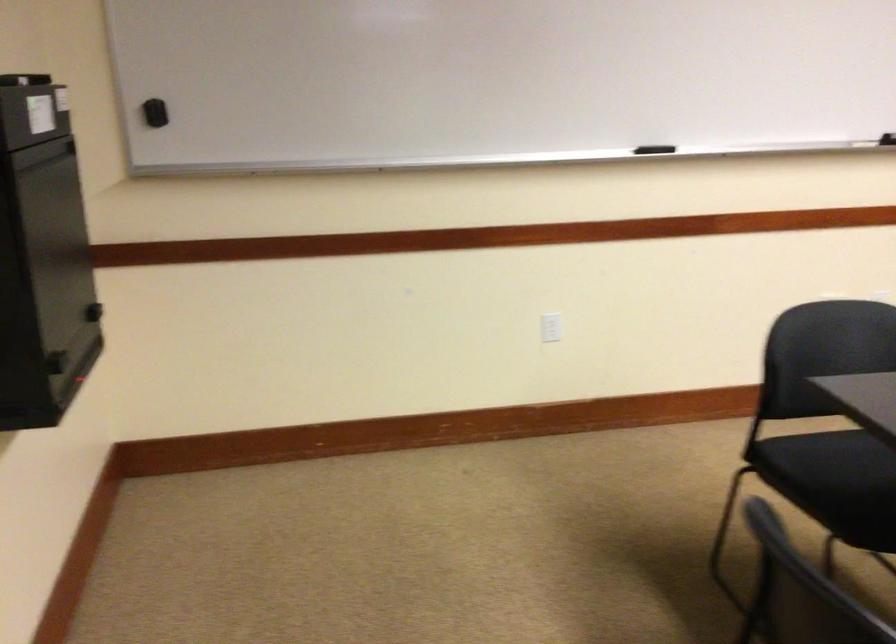
The width and height of the screenshot is (896, 644). Identify the location of chair sitting surface. (837, 483).